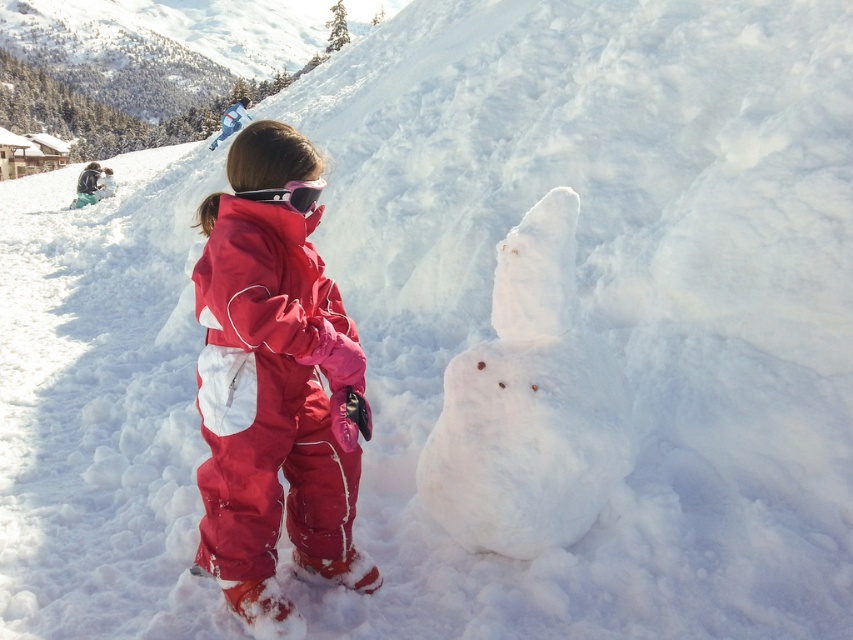
You are a photographer trying to capture the child in the snow. You need to ensure both the red matte snowsuit at center and the pink matte goggles at center are clearly visible in the photo. Given their sizes, which object will require more focus adjustment to ensure clarity?

The red matte snowsuit at center is bigger than the pink matte goggles at center, so the goggles may need more precise focus adjustment to ensure their smaller details are clear in the photo.